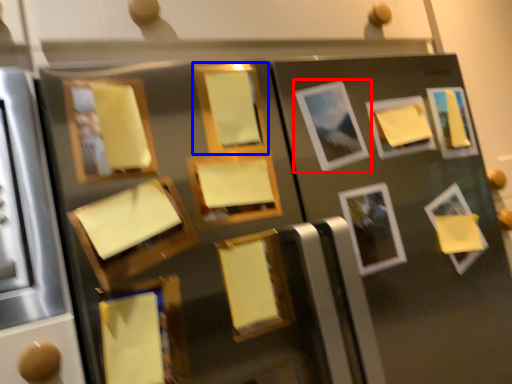
Question: Which of the following is the farthest to the observer, picture frame (highlighted by a red box) or picture frame (highlighted by a blue box)?

Choices:
 (A) picture frame
 (B) picture frame

Answer: (A)